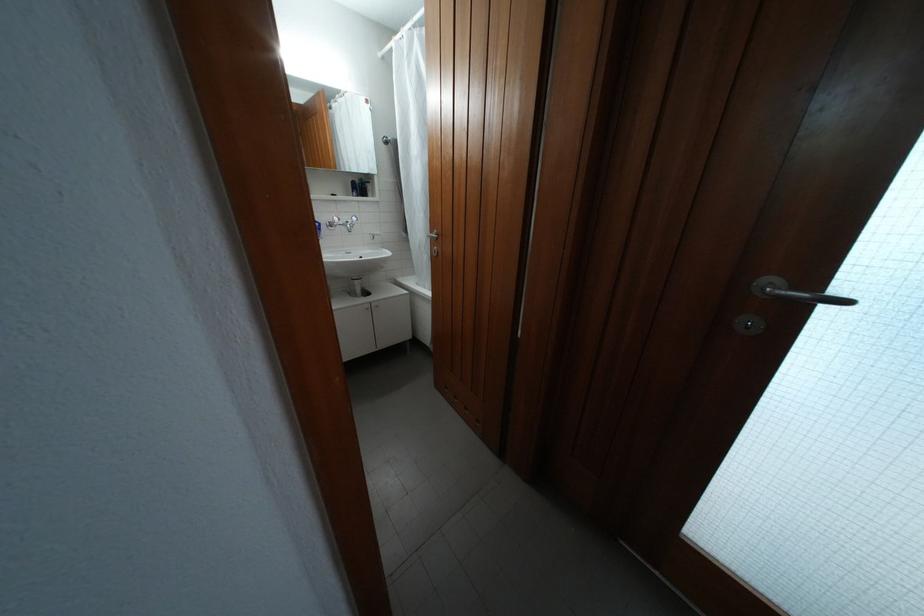
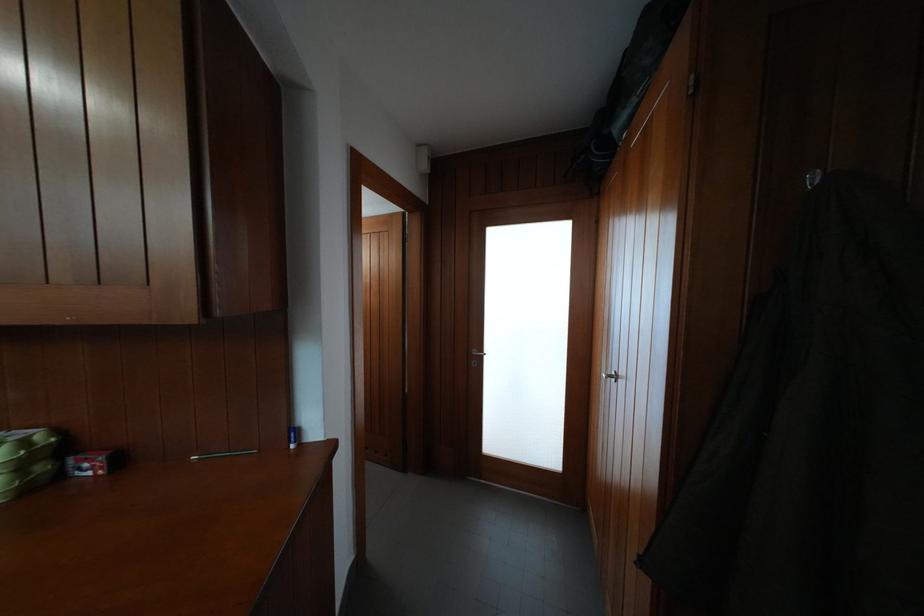
Locate, in the second image, the point that corresponds to [791,294] in the first image.

(484, 358)